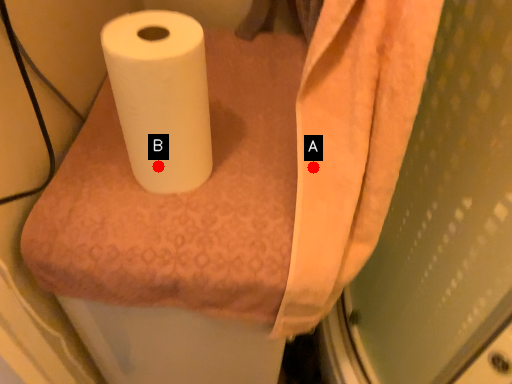
Question: Two points are circled on the image, labeled by A and B beside each circle. Which point is closer to the camera?

Choices:
 (A) A is closer
 (B) B is closer

Answer: (B)